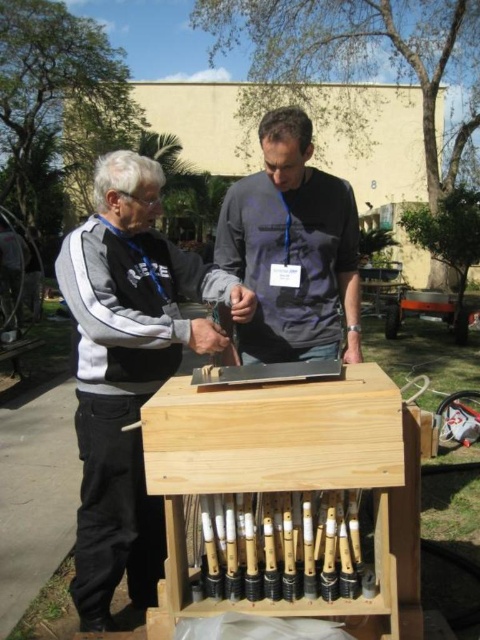
What do you see at coordinates (190, 324) in the screenshot?
I see `wooden table at center` at bounding box center [190, 324].

Which of these two, wooden table at center or dark gray matte shirt at center, stands taller?

wooden table at center

Who is more distant from viewer, (243, 336) or (263, 132)?

Point (243, 336)

Image resolution: width=480 pixels, height=640 pixels. Identify the location of wooden table at center. (190, 324).